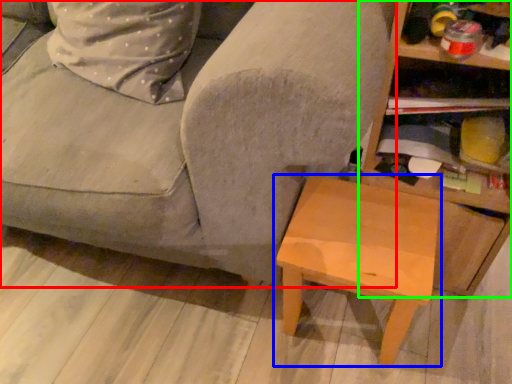
Question: Considering the real-world distances, which object is closest to studio couch (highlighted by a red box)? table (highlighted by a blue box) or shelf (highlighted by a green box).

Choices:
 (A) table
 (B) shelf

Answer: (A)